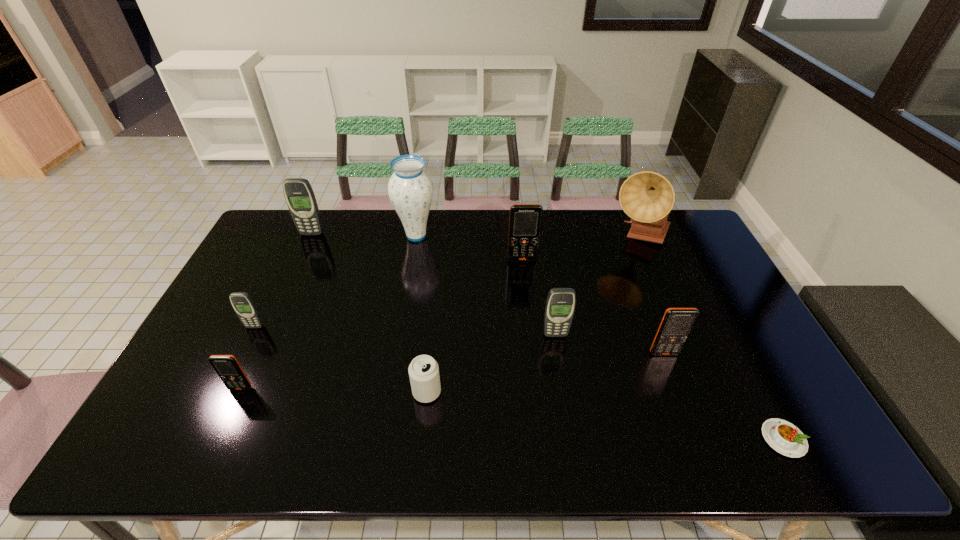
Image resolution: width=960 pixels, height=540 pixels. In order to click on the leftmost orange cellular telephone in this screenshot , I will do `click(227, 367)`.

Image resolution: width=960 pixels, height=540 pixels. Find the location of `the smallest orange cellular telephone`. the smallest orange cellular telephone is located at coordinates (227, 367).

The height and width of the screenshot is (540, 960). I want to click on the second farthest gray cellular telephone, so click(x=244, y=306).

Find the location of a particular element. This screenshot has height=540, width=960. the third farthest cellular telephone is located at coordinates (244, 306).

Image resolution: width=960 pixels, height=540 pixels. I want to click on can, so click(424, 376).

Where is `pudding`? The height and width of the screenshot is (540, 960). pudding is located at coordinates (784, 437).

Identify the location of the shortest object. (784, 437).

Locate an element on the screen. free space located 0.130m on the horn of the phonograph record is located at coordinates (659, 284).

I want to click on vacant space located 0.140m on the right of the vase, so click(476, 235).

Find the location of `vacant space located on the screen of the biggest orange cellular telephone`. vacant space located on the screen of the biggest orange cellular telephone is located at coordinates (531, 342).